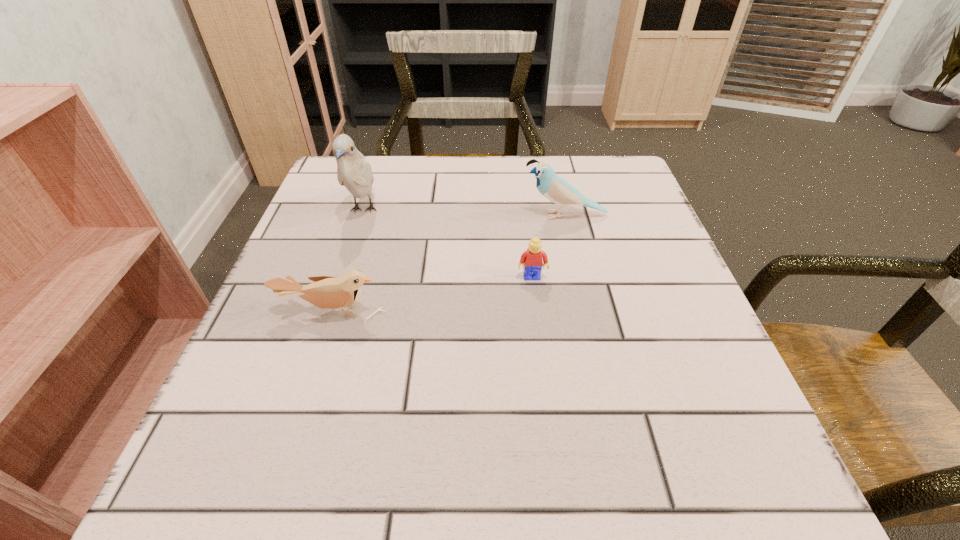
Locate an element on the screen. the tallest object is located at coordinates (354, 172).

Where is `the second tallest bird`? Image resolution: width=960 pixels, height=540 pixels. the second tallest bird is located at coordinates (557, 190).

Where is `the rightmost bird`? The image size is (960, 540). the rightmost bird is located at coordinates (557, 190).

The width and height of the screenshot is (960, 540). I want to click on the nearest bird, so click(326, 292).

I want to click on the shortest bird, so click(x=326, y=292).

The height and width of the screenshot is (540, 960). I want to click on Lego, so click(x=531, y=260).

Identify the location of vacant region located 0.120m at the beak of the tallest object. (343, 274).

Where is `vacant position located at the face of the second tallest bird`? This screenshot has width=960, height=540. vacant position located at the face of the second tallest bird is located at coordinates (375, 215).

Identify the location of vacant space located 0.400m at the face of the second tallest bird. (339, 215).

I want to click on free region located at the face of the second tallest bird, so click(348, 215).